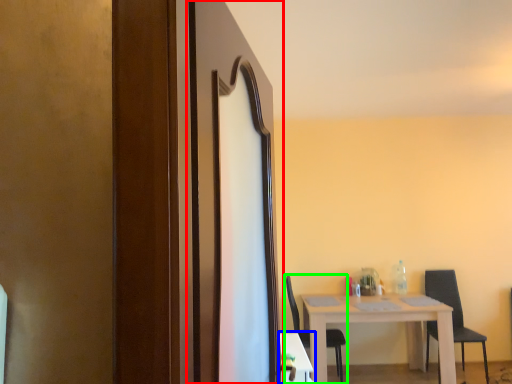
Question: Which object is positioned farthest from screen door (highlighted by a red box)? Select from table (highlighted by a blue box) and chair (highlighted by a green box).

Choices:
 (A) table
 (B) chair

Answer: (B)